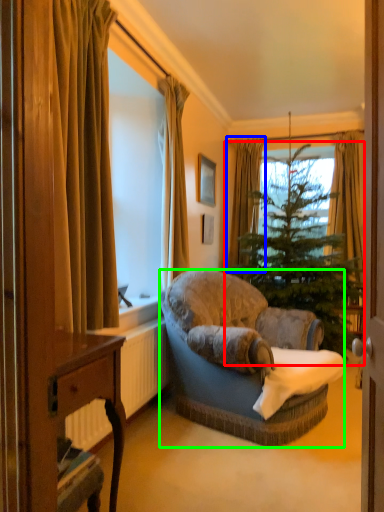
Question: Which object is positioned closest to christmas tree (highlighted by a red box)? Select from curtain (highlighted by a blue box) and studio couch (highlighted by a green box).

Choices:
 (A) curtain
 (B) studio couch

Answer: (A)